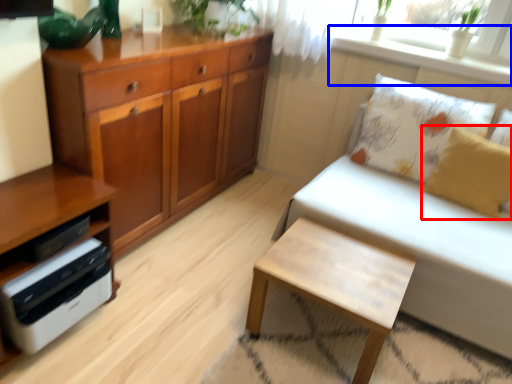
Question: Which object appears farthest to the camera in this image, pillow (highlighted by a red box) or window sill (highlighted by a blue box)?

Choices:
 (A) pillow
 (B) window sill

Answer: (B)